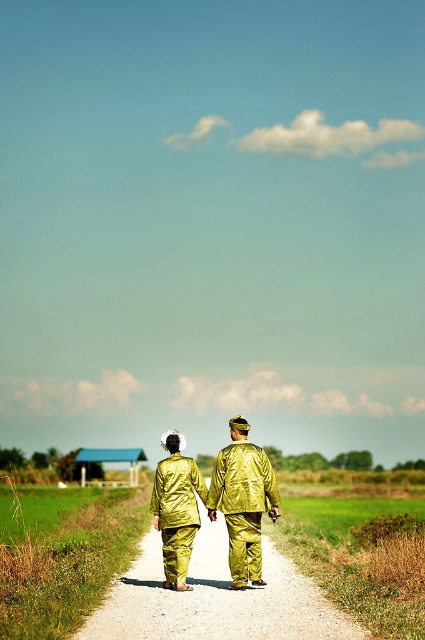
Identify the location of shiny gold suit at center. (243, 500).

Is point (237, 449) closer to camera compared to point (166, 472)?

Yes.

Identify the location of shiny gold suit at center. This screenshot has height=640, width=425. (243, 500).

Between gold shiny pants at center and shiny gold suit at center, which one has more height?

gold shiny pants at center

The image size is (425, 640). Describe the element at coordinates (215, 598) in the screenshot. I see `gold shiny pants at center` at that location.

Which is in front, point (297, 598) or point (257, 568)?

Point (297, 598) is more forward.

This screenshot has width=425, height=640. In order to click on gold shiny pants at center in this screenshot , I will do `click(215, 598)`.

Who is lower down, gold shiny pants at center or shiny gold trench coat at center?

gold shiny pants at center

Is gold shiny pants at center taller than shiny gold trench coat at center?

Yes.

Identify the location of gold shiny pants at center. Image resolution: width=425 pixels, height=640 pixels. (215, 598).